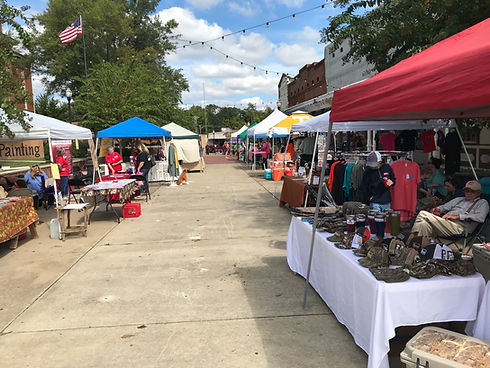
Find the location of `lights`. lights is located at coordinates (198, 44).